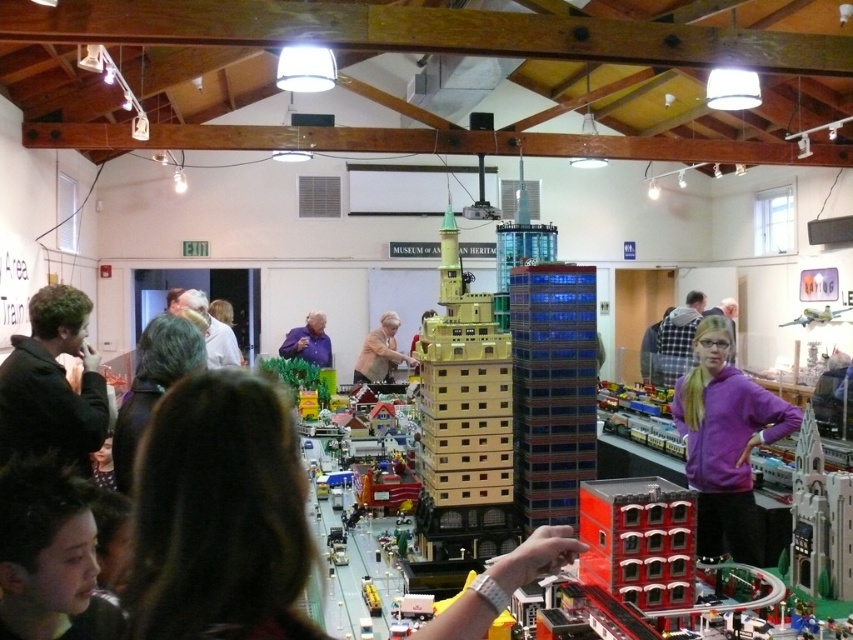
You are an art curator examining the model cityscape. You notice a specific point in the model city at coordinates (219, 515). What object is located at that point?

The brown hair at center is located at point (219, 515).

You are a tour guide explaining the model city to visitors. You point to two specific points in the model. The first point is at coordinate (735, 461), and the second is at (686, 522). A visitor asks which point is closer to the front of the model. How do you respond?

The point at (686, 522) is closer to the front of the model because it is in front of the point at (735, 461).